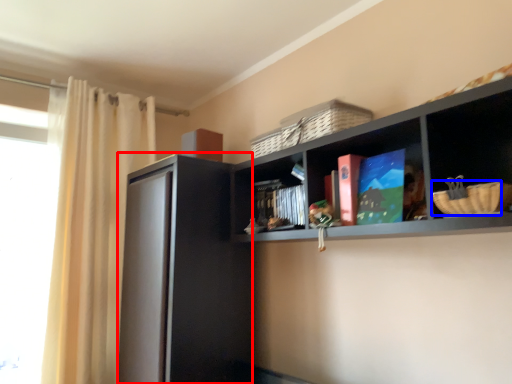
Question: Which point is further to the camera, screen door (highlighted by a red box) or basket (highlighted by a blue box)?

Choices:
 (A) screen door
 (B) basket

Answer: (A)